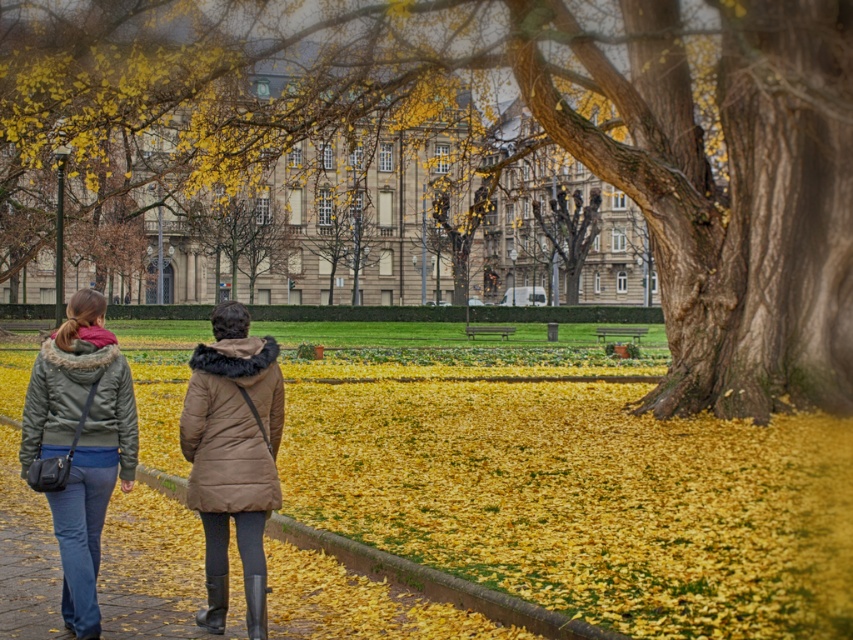
Is smooth bark tree at center right positioned before brown puffy coat at center?

No, smooth bark tree at center right is behind brown puffy coat at center.

Which of these two, smooth bark tree at center right or brown puffy coat at center, stands taller?

smooth bark tree at center right

Looking at this image, who is more distant from viewer, (560, 33) or (219, 368)?

Positioned behind is point (560, 33).

This screenshot has height=640, width=853. What are the coordinates of `smooth bark tree at center right` in the screenshot? It's located at (728, 188).

Between smooth bark tree at center right and brown stone building at center, which one has more height?

brown stone building at center

Can you confirm if smooth bark tree at center right is smaller than brown stone building at center?

Yes, smooth bark tree at center right is smaller than brown stone building at center.

Who is more forward, (833, 29) or (468, 147)?

Positioned in front is point (833, 29).

Image resolution: width=853 pixels, height=640 pixels. In order to click on smooth bark tree at center right in this screenshot , I will do `click(728, 188)`.

Who is higher up, matte green jacket at lower left or matte green coat at left?

matte green coat at left is above.

The image size is (853, 640). What do you see at coordinates (80, 442) in the screenshot?
I see `matte green jacket at lower left` at bounding box center [80, 442].

Does point (126, 381) lie in front of point (106, 435)?

That is False.

At what (x,y) coordinates should I click in order to perform the action: click on matte green jacket at lower left. Please return your answer as a coordinate pair (x, y). This screenshot has width=853, height=640. Looking at the image, I should click on (80, 442).